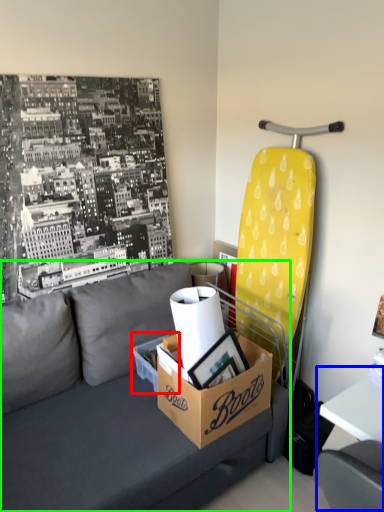
Question: Which object is the closest to the cardboard box (highlighted by a red box)? Choose among these: table (highlighted by a blue box) or studio couch (highlighted by a green box).

Choices:
 (A) table
 (B) studio couch

Answer: (B)